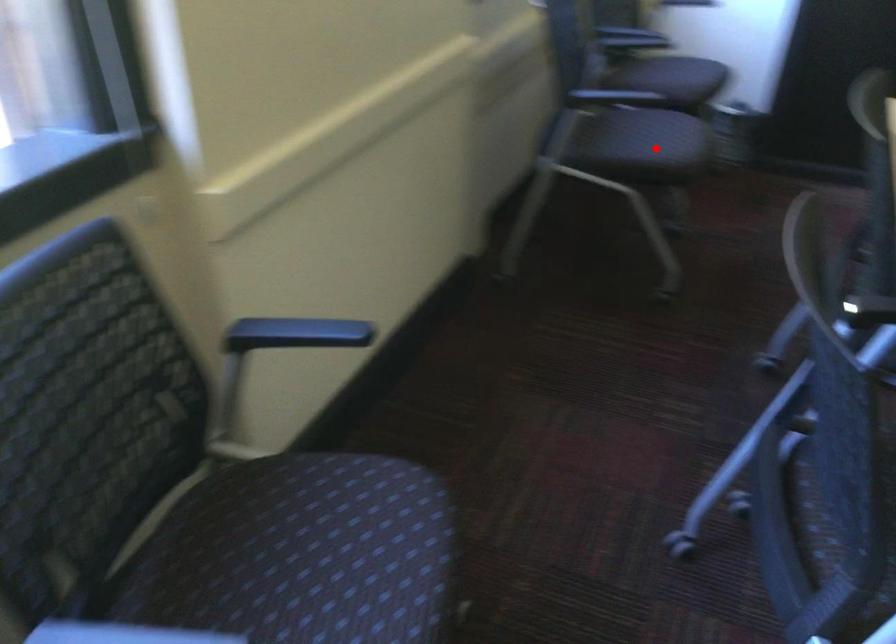
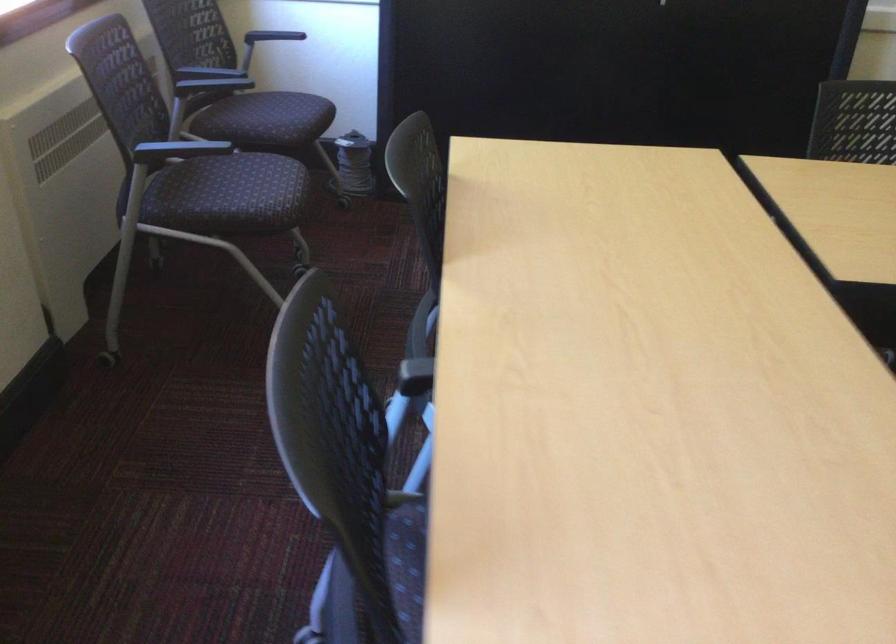
Where in the second image is the point corresponding to the highlighted location from the first image?

(250, 198)